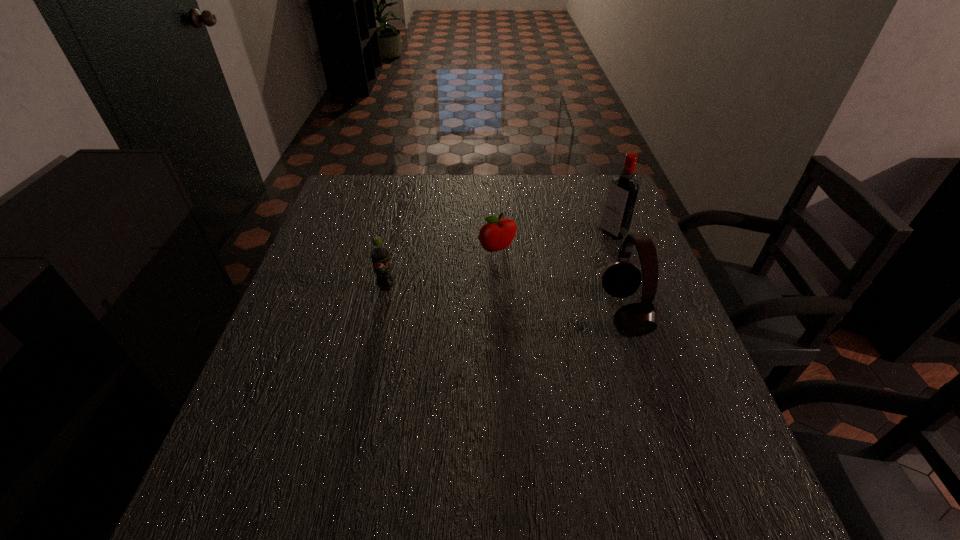
Where is `free space located 0.350m on the front and back of the farthest object`? free space located 0.350m on the front and back of the farthest object is located at coordinates (508, 293).

The height and width of the screenshot is (540, 960). Identify the location of vacant position located 0.200m on the front and back of the farthest object. (552, 268).

Locate an element on the screen. The width and height of the screenshot is (960, 540). vacant space situated on the front and back of the farthest object is located at coordinates (544, 273).

This screenshot has height=540, width=960. Identify the location of free space located on the front-facing side of the third object from right to left. (553, 344).

The width and height of the screenshot is (960, 540). Identify the location of vacant space located on the front-facing side of the third object from right to left. pyautogui.click(x=512, y=271).

Locate an element on the screen. The height and width of the screenshot is (540, 960). free space located 0.140m on the front-facing side of the third object from right to left is located at coordinates (523, 292).

Identify the location of headset situated at the right edge. The image size is (960, 540). (621, 278).

You are a GUI agent. You are given a task and a screenshot of the screen. Output one action in this format:
    pyautogui.click(x=<x>, y=<y>)
    Task: Click on the vodka that is at the right edge
    This screenshot has height=540, width=960.
    Given the screenshot: What is the action you would take?
    pyautogui.click(x=621, y=198)

You are a GUI agent. You are given a task and a screenshot of the screen. Output one action in this format:
    pyautogui.click(x=<x>, y=<y>)
    Task: Click on the free space at the far edge of the desktop
    The image size is (960, 540).
    Given the screenshot: What is the action you would take?
    pyautogui.click(x=460, y=196)

At what (x,y) coordinates should I click in order to perform the action: click on free space at the left edge of the desktop. Please return your answer as a coordinate pair (x, y). This screenshot has width=960, height=540. Looking at the image, I should click on (328, 351).